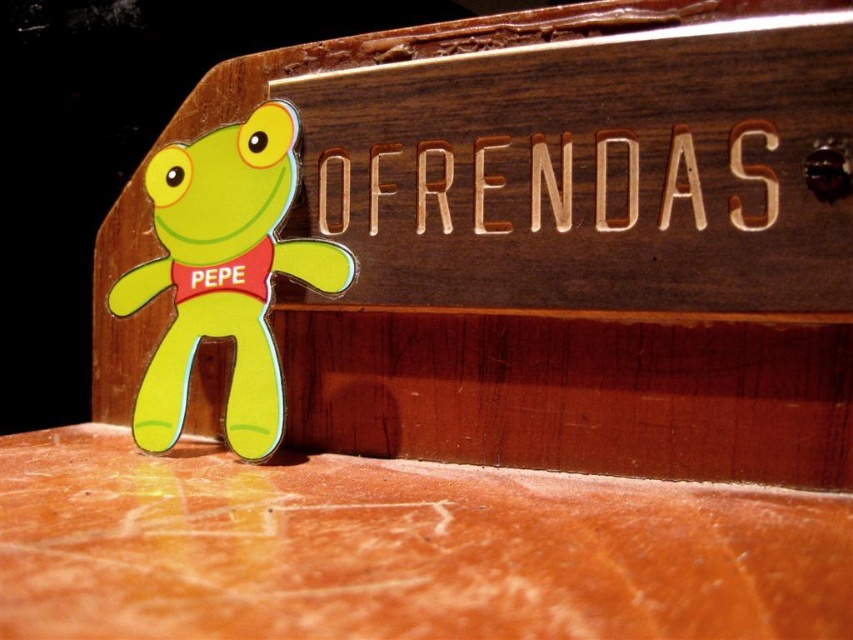
Question: Among these points, which one is nearest to the camera?

Choices:
 (A) (198, 276)
 (B) (718, 49)

Answer: (B)

Question: Which point is closer to the camera taking this photo?

Choices:
 (A) (206, 241)
 (B) (550, 384)

Answer: (B)

Question: Can you confirm if wooden sign at upper center is positioned to the right of matte green plush frog at lower left?

Choices:
 (A) no
 (B) yes

Answer: (B)

Question: Is wooden sign at upper center above wooden sign at center?

Choices:
 (A) no
 (B) yes

Answer: (A)

Question: Which point is closer to the camera?

Choices:
 (A) (746, 220)
 (B) (415, 376)
 (C) (202, 337)

Answer: (A)

Question: Can you confirm if wooden sign at upper center is thinner than matte green plush frog at lower left?

Choices:
 (A) yes
 (B) no

Answer: (B)